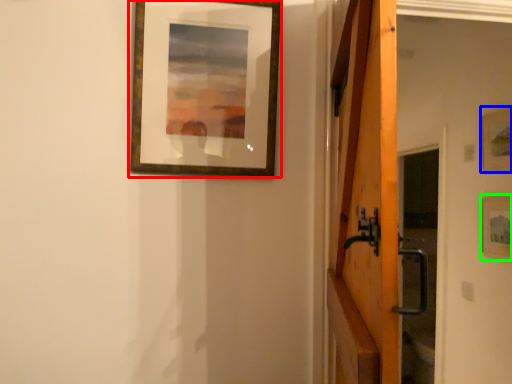
Question: Estimate the real-world distances between objects in this image. Which object is closer to picture frame (highlighted by a red box), picture frame (highlighted by a blue box) or picture frame (highlighted by a green box)?

Choices:
 (A) picture frame
 (B) picture frame

Answer: (A)